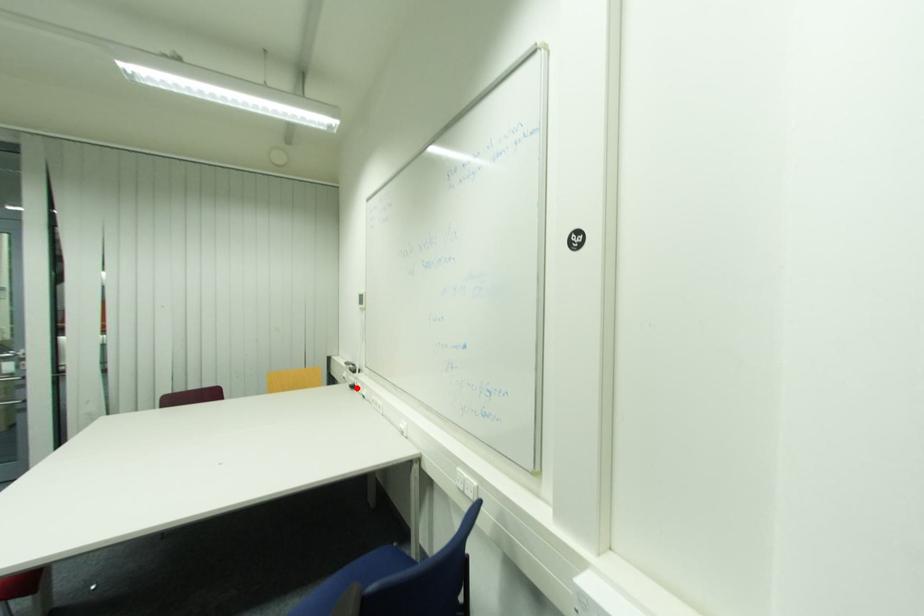
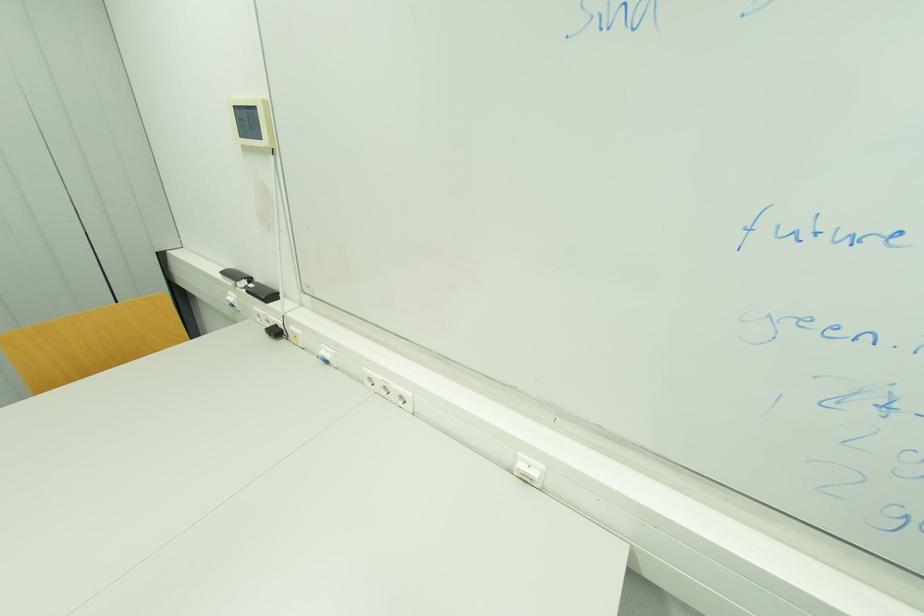
Question: I am providing you with two images of the same scene from different viewpoints. A red point is shown in image1. For the corresponding object point in image2, is it positioned nearer or farther from the camera?

Choices:
 (A) Nearer
 (B) Farther

Answer: (A)